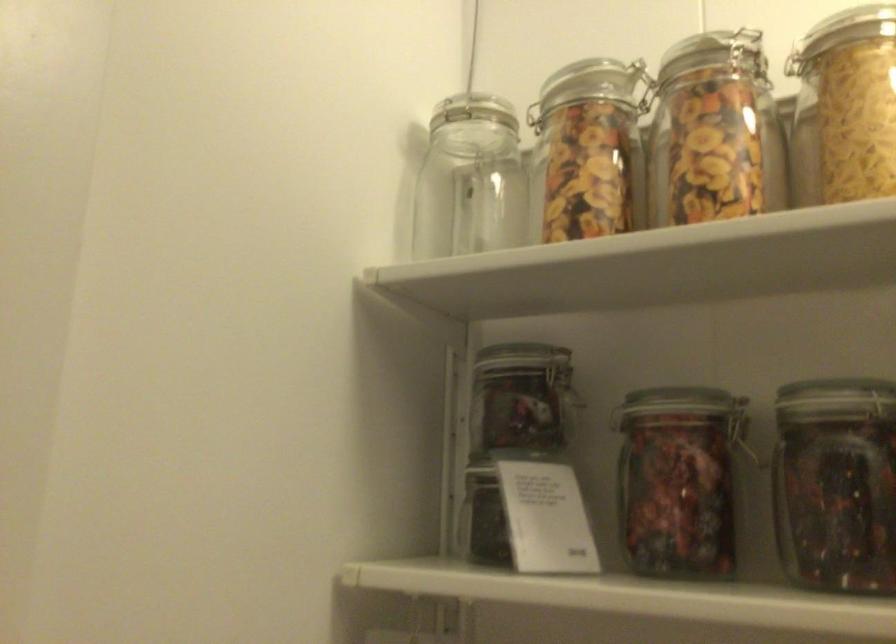
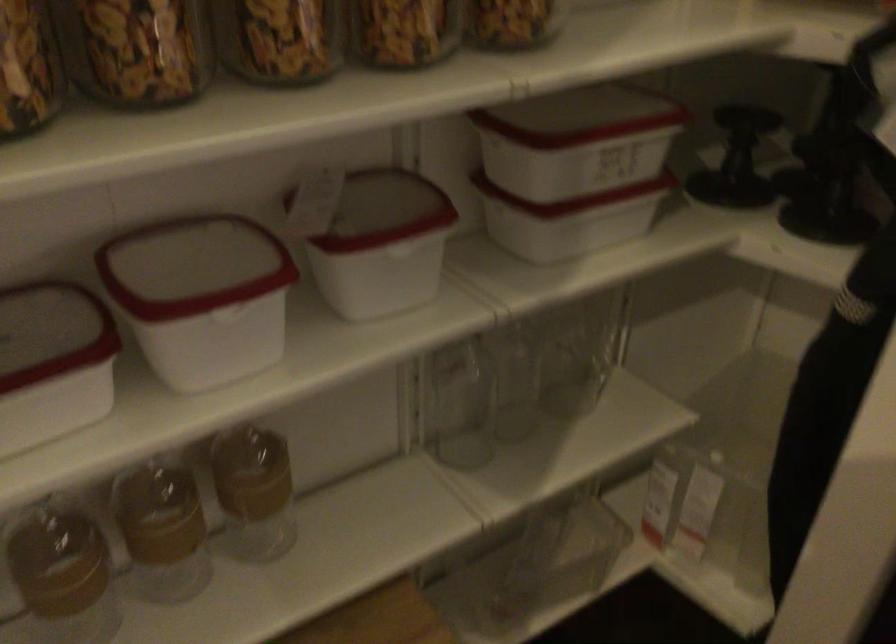
The first image is from the beginning of the video and the second image is from the end. How did the camera likely rotate when shooting the video?

The rotation direction of the camera is right-down.